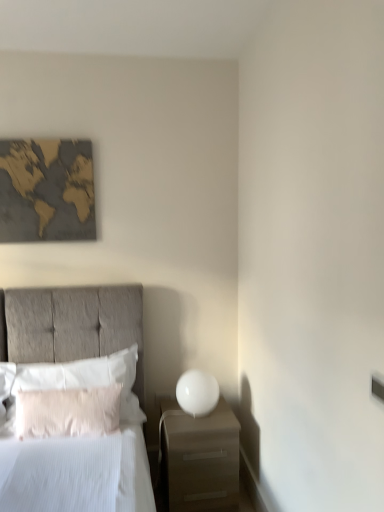
The height and width of the screenshot is (512, 384). What do you see at coordinates (46, 191) in the screenshot? I see `gold textured map at upper left` at bounding box center [46, 191].

Identify the location of matte gray bed at left. Image resolution: width=384 pixels, height=512 pixels. pyautogui.click(x=87, y=357).

What do you see at coordinates (87, 357) in the screenshot? The image size is (384, 512). I see `matte gray bed at left` at bounding box center [87, 357].

The image size is (384, 512). In order to click on white soft pillow at left, the 2th pillow when ordered from front to back in this screenshot , I will do `click(85, 378)`.

Where is `matte white nightstand at lower right`? Image resolution: width=384 pixels, height=512 pixels. matte white nightstand at lower right is located at coordinates (199, 458).

From the image's perspective, does white glossy sphere at right appear higher than matte white nightstand at lower right?

Yes, from the image's perspective, white glossy sphere at right is above matte white nightstand at lower right.

In the scene shown: How different are the orientations of white glossy sphere at right and matte white nightstand at lower right in degrees?

0.00134 degrees.

Between white glossy sphere at right and matte white nightstand at lower right, which one is positioned behind?

white glossy sphere at right.

Identify the location of nightstand in front of the white glossy sphere at right. (199, 458).

Does white soft pillow at left, the 1th pillow from the back, have a greater height compared to matte white nightstand at lower right?

Incorrect, the height of white soft pillow at left, the 1th pillow from the back, is not larger of that of matte white nightstand at lower right.

Is the position of white soft pillow at left, the 1th pillow from the back, more distant than that of matte white nightstand at lower right?

Yes, white soft pillow at left, the 1th pillow from the back, is behind matte white nightstand at lower right.

From the image's perspective, is white soft pillow at left, the 2th pillow when ordered from front to back, positioned above or below matte white nightstand at lower right?

white soft pillow at left, the 2th pillow when ordered from front to back, is above matte white nightstand at lower right.

Is white soft pillow at left, the 2th pillow when ordered from front to back, next to matte white nightstand at lower right and touching it?

white soft pillow at left, the 2th pillow when ordered from front to back, and matte white nightstand at lower right are clearly separated.

Who is more distant, white fluffy pillow at left, acting as the 1th pillow starting from the front, or matte white nightstand at lower right?

matte white nightstand at lower right is more distant.

Is white fluffy pillow at left, acting as the 1th pillow starting from the front, far away from matte white nightstand at lower right?

No, white fluffy pillow at left, acting as the 1th pillow starting from the front, is not far from matte white nightstand at lower right.

Can you confirm if white fluffy pillow at left, acting as the 1th pillow starting from the front, is smaller than matte white nightstand at lower right?

Correct, white fluffy pillow at left, acting as the 1th pillow starting from the front, occupies less space than matte white nightstand at lower right.

From a real-world perspective, does white fluffy pillow at left, acting as the 1th pillow starting from the front, stand above matte white nightstand at lower right?

Yes, from a real-world perspective, white fluffy pillow at left, acting as the 1th pillow starting from the front, is on top of matte white nightstand at lower right.

Locate an element on the screen. The width and height of the screenshot is (384, 512). pillow above the matte gray bed at left (from a real-world perspective) is located at coordinates (85, 378).

Considering the sizes of objects matte gray bed at left and white soft pillow at left, the 2th pillow when ordered from front to back, in the image provided, who is smaller, matte gray bed at left or white soft pillow at left, the 2th pillow when ordered from front to back,?

white soft pillow at left, the 2th pillow when ordered from front to back, is smaller.

Can you confirm if matte gray bed at left is taller than white soft pillow at left, the 2th pillow when ordered from front to back?

Yes.

Which is behind, point (131, 476) or point (53, 426)?

The point (53, 426) is farther.

Is matte gray bed at left behind white fluffy pillow at left, which appears as the 2th pillow when viewed from the back?

No.

Which is correct: matte gray bed at left is inside white fluffy pillow at left, acting as the 1th pillow starting from the front, or outside of it?

The correct answer is: outside.

From a real-world perspective, which object stands above the other?

matte gray bed at left.

How much distance is there between white soft pillow at left, the 1th pillow from the back, and matte gray bed at left?

white soft pillow at left, the 1th pillow from the back, is 6.00 inches away from matte gray bed at left.

Is white soft pillow at left, the 1th pillow from the back, touching matte gray bed at left?

No, white soft pillow at left, the 1th pillow from the back, is not in contact with matte gray bed at left.

Is white soft pillow at left, the 2th pillow when ordered from front to back, inside or outside of matte gray bed at left?

white soft pillow at left, the 2th pillow when ordered from front to back, exists entirely within matte gray bed at left.

Is white soft pillow at left, the 1th pillow from the back, positioned before matte gray bed at left?

No, white soft pillow at left, the 1th pillow from the back, is further to the viewer.

Which object is positioned more to the left, gold textured map at upper left or white glossy sphere at right?

gold textured map at upper left.

Can you tell me how much gold textured map at upper left and white glossy sphere at right differ in facing direction?

The facing directions of gold textured map at upper left and white glossy sphere at right are 2.05 degrees apart.

Is white glossy sphere at right surrounded by gold textured map at upper left?

That's incorrect, white glossy sphere at right is not inside gold textured map at upper left.

Considering the relative sizes of gold textured map at upper left and white glossy sphere at right in the image provided, is gold textured map at upper left thinner than white glossy sphere at right?

Indeed, gold textured map at upper left has a lesser width compared to white glossy sphere at right.

Locate an element on the screen. This screenshot has width=384, height=512. nightstand that appears below the white glossy sphere at right (from a real-world perspective) is located at coordinates (199, 458).

The image size is (384, 512). What are the coordinates of `the 2nd pillow above the matte white nightstand at lower right (from a real-world perspective)` in the screenshot? It's located at (85, 378).

When comparing their distances from matte gray bed at left, does white fluffy pillow at left, which appears as the 2th pillow when viewed from the back, or gold textured map at upper left seem closer?

Among the two, white fluffy pillow at left, which appears as the 2th pillow when viewed from the back, is located nearer to matte gray bed at left.

Consider the image. Considering their positions, is gold textured map at upper left positioned further to matte gray bed at left than white soft pillow at left, the 2th pillow when ordered from front to back?

gold textured map at upper left is further to matte gray bed at left.

Which object lies further to the anchor point white soft pillow at left, the 1th pillow from the back, gold textured map at upper left or white glossy sphere at right?

Among the two, gold textured map at upper left is located further to white soft pillow at left, the 1th pillow from the back.

When comparing their distances from matte white nightstand at lower right, does gold textured map at upper left or white glossy sphere at right seem further?

gold textured map at upper left.

When comparing their distances from matte white nightstand at lower right, does matte gray bed at left or white fluffy pillow at left, acting as the 1th pillow starting from the front, seem closer?

matte gray bed at left lies closer to matte white nightstand at lower right than the other object.

Considering their positions, is matte white nightstand at lower right positioned further to matte gray bed at left than white fluffy pillow at left, which appears as the 2th pillow when viewed from the back?

matte white nightstand at lower right.

Based on their spatial positions, is gold textured map at upper left or white fluffy pillow at left, which appears as the 2th pillow when viewed from the back, closer to white glossy sphere at right?

The object closer to white glossy sphere at right is white fluffy pillow at left, which appears as the 2th pillow when viewed from the back.

Which object lies further to the anchor point gold textured map at upper left, white soft pillow at left, the 2th pillow when ordered from front to back, or matte gray bed at left?

Among the two, white soft pillow at left, the 2th pillow when ordered from front to back, is located further to gold textured map at upper left.

This screenshot has height=512, width=384. I want to click on pillow between matte gray bed at left and matte white nightstand at lower right along the z-axis, so click(68, 412).

This screenshot has width=384, height=512. Find the location of `pillow situated between white fluffy pillow at left, which appears as the 2th pillow when viewed from the back, and matte white nightstand at lower right from left to right`. pillow situated between white fluffy pillow at left, which appears as the 2th pillow when viewed from the back, and matte white nightstand at lower right from left to right is located at coordinates (85, 378).

The height and width of the screenshot is (512, 384). I want to click on bedside lamp between white soft pillow at left, the 2th pillow when ordered from front to back, and matte white nightstand at lower right from left to right, so click(197, 393).

Locate an element on the screen. nightstand between matte gray bed at left and gold textured map at upper left along the z-axis is located at coordinates (199, 458).